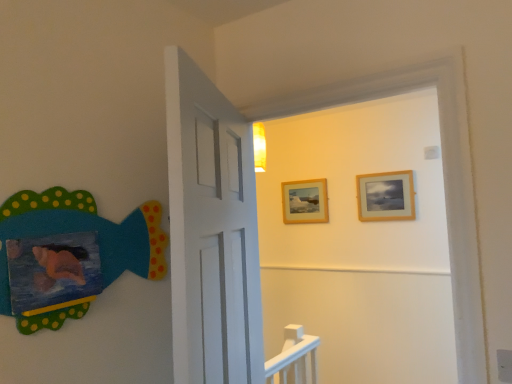
What do you see at coordinates (386, 196) in the screenshot? I see `wooden frame at upper right, which ranks as the 2th picture frame in left-to-right order` at bounding box center [386, 196].

Measure the distance between point (93, 212) and camera.

Point (93, 212) and camera are 1.23 meters apart.

This screenshot has width=512, height=384. What do you see at coordinates (305, 201) in the screenshot? I see `wooden frame at upper center, the 2th picture frame viewed from the front` at bounding box center [305, 201].

I want to click on wooden frame at upper right, the 2th picture frame when ordered from back to front, so click(386, 196).

Considering the positions of objects wooden frame at upper right, placed as the first picture frame when sorted from front to back, and wooden frame at upper center, marked as the first picture frame in a back-to-front arrangement, in the image provided, who is more to the left, wooden frame at upper right, placed as the first picture frame when sorted from front to back, or wooden frame at upper center, marked as the first picture frame in a back-to-front arrangement,?

wooden frame at upper center, marked as the first picture frame in a back-to-front arrangement.

Considering the sizes of wooden frame at upper right, placed as the first picture frame when sorted from front to back, and wooden frame at upper center, the second picture frame viewed from the right, in the image, is wooden frame at upper right, placed as the first picture frame when sorted from front to back, taller or shorter than wooden frame at upper center, the second picture frame viewed from the right,?

wooden frame at upper right, placed as the first picture frame when sorted from front to back, is taller than wooden frame at upper center, the second picture frame viewed from the right.

Can you confirm if wooden frame at upper right, placed as the first picture frame when sorted from front to back, is smaller than wooden frame at upper center, the 2th picture frame viewed from the front?

Actually, wooden frame at upper right, placed as the first picture frame when sorted from front to back, might be larger than wooden frame at upper center, the 2th picture frame viewed from the front.

Consider the image. Considering the sizes of matte felt fish at left and wooden frame at upper right, positioned as the 1th picture frame in right-to-left order, in the image, is matte felt fish at left taller or shorter than wooden frame at upper right, positioned as the 1th picture frame in right-to-left order,?

In the image, matte felt fish at left appears to be taller than wooden frame at upper right, positioned as the 1th picture frame in right-to-left order.

Is point (81, 314) positioned after point (388, 216)?

No, (81, 314) is closer to viewer.

From the image's perspective, which is above, matte felt fish at left or wooden frame at upper right, the 2th picture frame when ordered from back to front?

wooden frame at upper right, the 2th picture frame when ordered from back to front, appears higher in the image.

Does matte felt fish at left have a larger size compared to wooden frame at upper right, the 2th picture frame when ordered from back to front?

Correct, matte felt fish at left is larger in size than wooden frame at upper right, the 2th picture frame when ordered from back to front.

Find the location of a particular element. picture frame that is the 2nd object located behind the matte felt fish at left is located at coordinates [x=305, y=201].

Does point (302, 208) lie in front of point (140, 244)?

No, (302, 208) is further to viewer.

In the image, is wooden frame at upper center, the 1th picture frame in the left-to-right sequence, on the left side or the right side of matte felt fish at left?

Based on their positions, wooden frame at upper center, the 1th picture frame in the left-to-right sequence, is located to the right of matte felt fish at left.

Is matte felt fish at left to the left of wooden frame at upper center, marked as the first picture frame in a back-to-front arrangement, from the viewer's perspective?

Yes, matte felt fish at left is to the left of wooden frame at upper center, marked as the first picture frame in a back-to-front arrangement.

Does point (89, 202) appear closer or farther from the camera than point (317, 198)?

Point (89, 202) appears to be closer to the viewer than point (317, 198).

Considering the relative positions of matte felt fish at left and wooden frame at upper center, the 2th picture frame viewed from the front, in the image provided, is matte felt fish at left in front of wooden frame at upper center, the 2th picture frame viewed from the front,?

Yes, the depth of matte felt fish at left is less than that of wooden frame at upper center, the 2th picture frame viewed from the front.

From the image's perspective, does matte felt fish at left appear lower than wooden frame at upper center, the 1th picture frame in the left-to-right sequence?

Yes.

Would you say wooden frame at upper center, marked as the first picture frame in a back-to-front arrangement, is a long distance from wooden frame at upper right, which ranks as the 2th picture frame in left-to-right order?

No, wooden frame at upper center, marked as the first picture frame in a back-to-front arrangement, is not far from wooden frame at upper right, which ranks as the 2th picture frame in left-to-right order.

Considering the relative sizes of wooden frame at upper center, the second picture frame viewed from the right, and wooden frame at upper right, placed as the first picture frame when sorted from front to back, in the image provided, is wooden frame at upper center, the second picture frame viewed from the right, smaller than wooden frame at upper right, placed as the first picture frame when sorted from front to back,?

Yes.

From the image's perspective, does wooden frame at upper center, the 1th picture frame in the left-to-right sequence, appear lower than wooden frame at upper right, which ranks as the 2th picture frame in left-to-right order?

Indeed, from the image's perspective, wooden frame at upper center, the 1th picture frame in the left-to-right sequence, is shown beneath wooden frame at upper right, which ranks as the 2th picture frame in left-to-right order.

Between wooden frame at upper center, the 2th picture frame viewed from the front, and wooden frame at upper right, the 2th picture frame when ordered from back to front, which one is positioned behind?

wooden frame at upper center, the 2th picture frame viewed from the front.

Measure the distance from wooden frame at upper right, the 2th picture frame when ordered from back to front, to matte felt fish at left.

The distance of wooden frame at upper right, the 2th picture frame when ordered from back to front, from matte felt fish at left is 7.39 feet.

Where is `art lying on the left of wooden frame at upper right, which ranks as the 2th picture frame in left-to-right order`? Image resolution: width=512 pixels, height=384 pixels. art lying on the left of wooden frame at upper right, which ranks as the 2th picture frame in left-to-right order is located at coordinates (91, 227).

Is the position of wooden frame at upper right, placed as the first picture frame when sorted from front to back, less distant than that of matte felt fish at left?

No, wooden frame at upper right, placed as the first picture frame when sorted from front to back, is further to the viewer.

Would you consider wooden frame at upper right, the 2th picture frame when ordered from back to front, to be distant from matte felt fish at left?

Yes.

I want to click on picture frame to the left of wooden frame at upper right, which ranks as the 2th picture frame in left-to-right order, so click(x=305, y=201).

Identify the location of the 2nd picture frame to the right of the matte felt fish at left, starting your count from the anchor. The height and width of the screenshot is (384, 512). (386, 196).

When comparing their distances from wooden frame at upper center, marked as the first picture frame in a back-to-front arrangement, does matte felt fish at left or wooden frame at upper right, the 2th picture frame when ordered from back to front, seem closer?

Based on the image, wooden frame at upper right, the 2th picture frame when ordered from back to front, appears to be nearer to wooden frame at upper center, marked as the first picture frame in a back-to-front arrangement.

Based on their spatial positions, is wooden frame at upper center, the 2th picture frame viewed from the front, or wooden frame at upper right, placed as the first picture frame when sorted from front to back, further from matte felt fish at left?

Based on the image, wooden frame at upper center, the 2th picture frame viewed from the front, appears to be further to matte felt fish at left.

From the image, which object appears to be nearer to wooden frame at upper right, placed as the first picture frame when sorted from front to back, wooden frame at upper center, the second picture frame viewed from the right, or matte felt fish at left?

wooden frame at upper center, the second picture frame viewed from the right.

Looking at the image, which one is located closer to wooden frame at upper right, placed as the first picture frame when sorted from front to back, matte felt fish at left or wooden frame at upper center, the 1th picture frame in the left-to-right sequence?

wooden frame at upper center, the 1th picture frame in the left-to-right sequence, is positioned closer to the anchor wooden frame at upper right, placed as the first picture frame when sorted from front to back.

Looking at this image, estimate the real-world distances between objects in this image. Which object is closer to wooden frame at upper center, the second picture frame viewed from the right, wooden frame at upper right, the 2th picture frame when ordered from back to front, or matte felt fish at left?

Based on the image, wooden frame at upper right, the 2th picture frame when ordered from back to front, appears to be nearer to wooden frame at upper center, the second picture frame viewed from the right.

When comparing their distances from matte felt fish at left, does wooden frame at upper right, which ranks as the 2th picture frame in left-to-right order, or wooden frame at upper center, the second picture frame viewed from the right, seem closer?

The object closer to matte felt fish at left is wooden frame at upper right, which ranks as the 2th picture frame in left-to-right order.

This screenshot has height=384, width=512. I want to click on picture frame between matte felt fish at left and wooden frame at upper center, the second picture frame viewed from the right, in the front-back direction, so (386, 196).